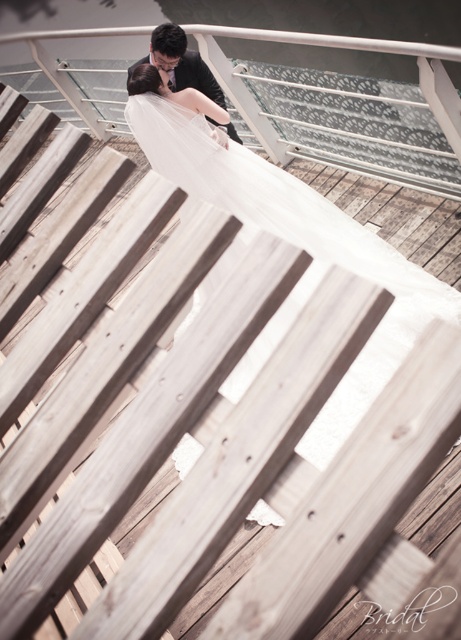
Question: Among these points, which one is farthest from the camera?

Choices:
 (A) (x=267, y=211)
 (B) (x=204, y=83)

Answer: (B)

Question: Does white lace dress at upper center have a larger size compared to black satin suit at center?

Choices:
 (A) no
 (B) yes

Answer: (B)

Question: Can you confirm if white lace dress at upper center is positioned above black satin suit at center?

Choices:
 (A) yes
 (B) no

Answer: (B)

Question: Which point is closer to the camera?

Choices:
 (A) (283, 237)
 (B) (148, 60)

Answer: (A)

Question: Does white lace dress at upper center have a greater width compared to black satin suit at center?

Choices:
 (A) yes
 (B) no

Answer: (A)